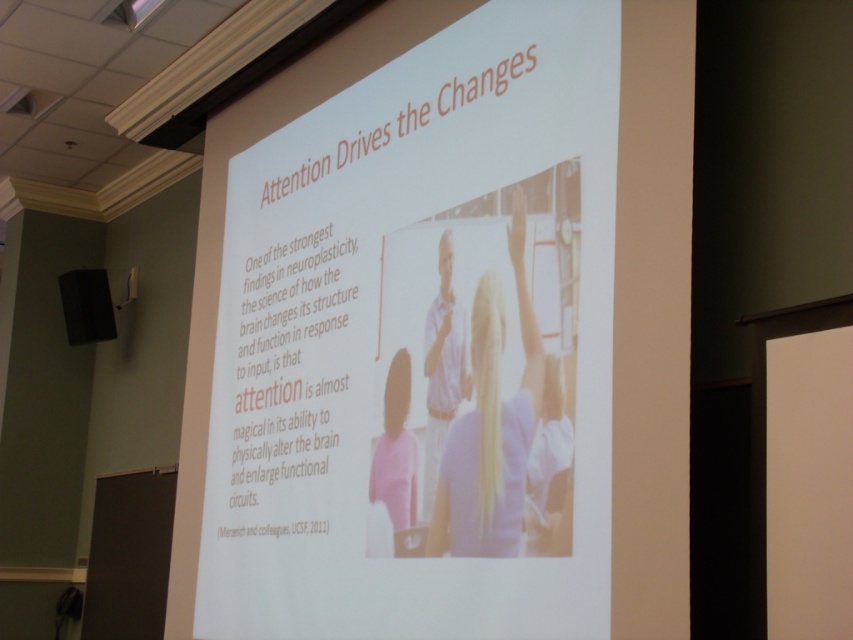
Question: Can you confirm if pink matte shirt at lower center is wider than matte black speaker at left?

Choices:
 (A) yes
 (B) no

Answer: (B)

Question: Is pink matte shirt at lower center below matte black speaker at left?

Choices:
 (A) yes
 (B) no

Answer: (A)

Question: Which point is farther from the camera taking this photo?

Choices:
 (A) (99, 330)
 (B) (479, 372)

Answer: (A)

Question: Is pink matte shirt at lower center below matte black speaker at left?

Choices:
 (A) no
 (B) yes

Answer: (B)

Question: Which of the following is the farthest from the observer?

Choices:
 (A) white shirt at center
 (B) pink matte shirt at lower center
 (C) white cotton shirt at center

Answer: (B)

Question: Which object is positioned closest to the white shirt at center?

Choices:
 (A) white cotton shirt at center
 (B) matte black speaker at left

Answer: (A)